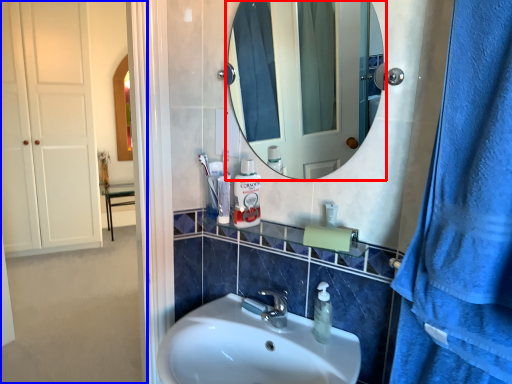
Question: Which object appears closest to the camera in this image, mirror (highlighted by a red box) or side (highlighted by a blue box)?

Choices:
 (A) mirror
 (B) side

Answer: (A)